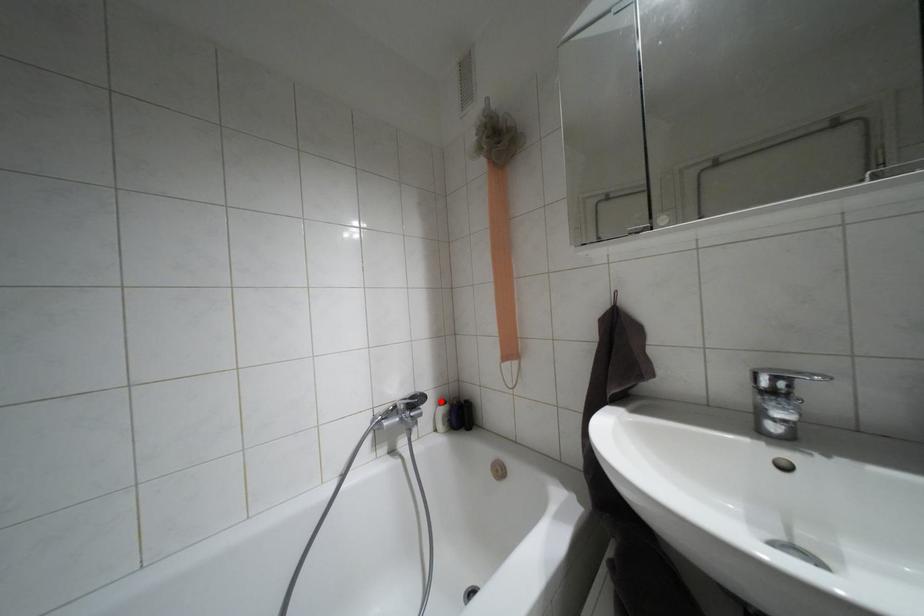
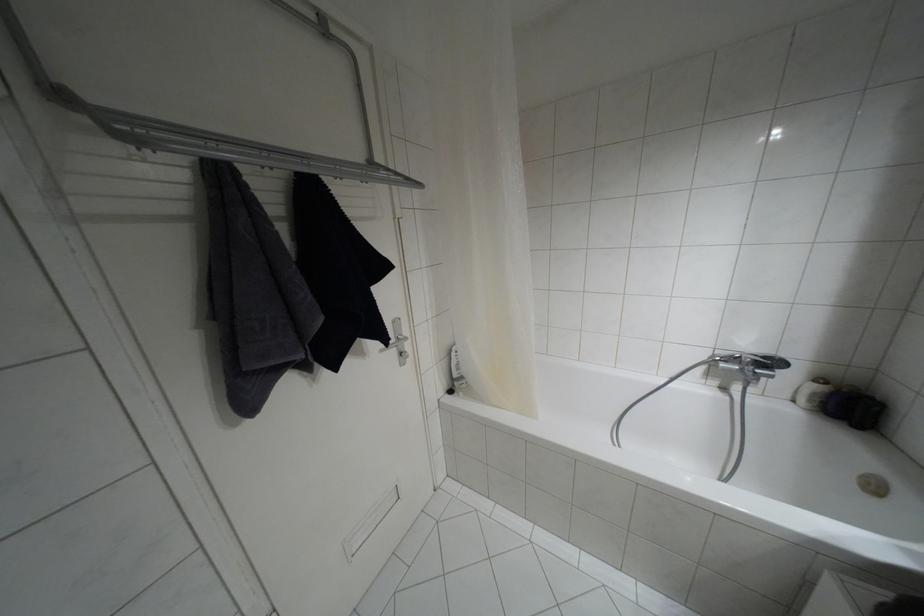
Question: I am providing you with two images of the same scene from different viewpoints. In image1, a red point is highlighted. Considering the same 3D point in image2, which of the following is correct?

Choices:
 (A) It is closer
 (B) It is farther

Answer: (A)